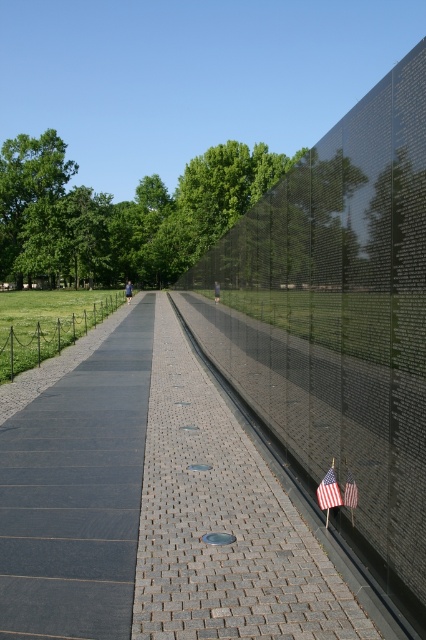
Can you confirm if dark gray paving stone at center is bigger than black wire fence at left?

No.

Which is in front, point (89, 577) or point (17, 355)?

Point (89, 577) is more forward.

Find the location of a particular element. This screenshot has width=426, height=640. dark gray paving stone at center is located at coordinates (77, 493).

How distant is gray brick pavement at center from black wire fence at left?

gray brick pavement at center and black wire fence at left are 10.97 meters apart from each other.

Consider the image. Is gray brick pavement at center bigger than black wire fence at left?

No, gray brick pavement at center is not bigger than black wire fence at left.

At what (x,y) coordinates should I click in order to perform the action: click on gray brick pavement at center. Please return your answer as a coordinate pair (x, y). Looking at the image, I should click on (152, 509).

Which of these two, black wire fence at left or american flag at lower right, stands shorter?

With less height is american flag at lower right.

Does point (48, 349) come in front of point (354, 490)?

No.

Is point (5, 330) positioned before point (345, 493)?

No, it is behind (345, 493).

What are the coordinates of `black wire fence at left` in the screenshot? It's located at (48, 336).